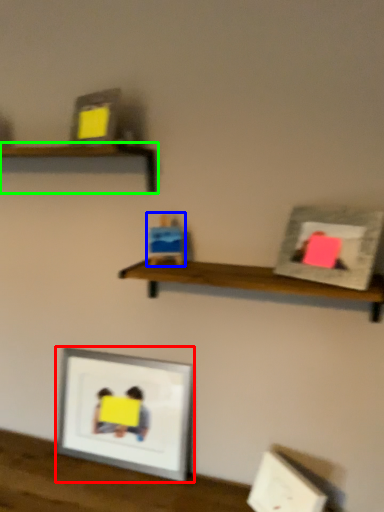
Question: Considering the real-world distances, which object is closest to picture frame (highlighted by a red box)? toy (highlighted by a blue box) or shelf (highlighted by a green box).

Choices:
 (A) toy
 (B) shelf

Answer: (A)